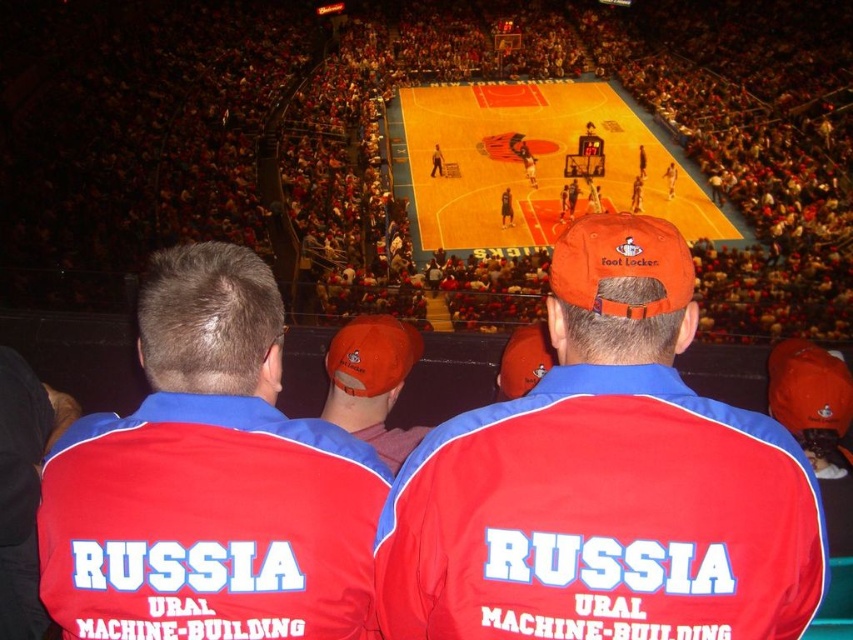
Question: Does matte red cap at center have a greater width compared to red fabric jacket at center?

Choices:
 (A) no
 (B) yes

Answer: (B)

Question: Is red fabric jacket at center further to camera compared to orange fabric cap at center?

Choices:
 (A) no
 (B) yes

Answer: (A)

Question: Is matte red cap at center behind orange polished wood basketball court at center?

Choices:
 (A) yes
 (B) no

Answer: (B)

Question: Which object is positioned closest to the red fabric jacket at center?

Choices:
 (A) orange polished wood basketball court at center
 (B) orange fabric cap at center
 (C) matte red cap at center

Answer: (C)

Question: Which of the following is the closest to the observer?

Choices:
 (A) (434, 557)
 (B) (538, 244)
 (C) (91, 566)

Answer: (C)

Question: Which point is farther from the camera taking this photo?

Choices:
 (A) (225, 444)
 (B) (498, 138)
 (C) (375, 608)

Answer: (B)